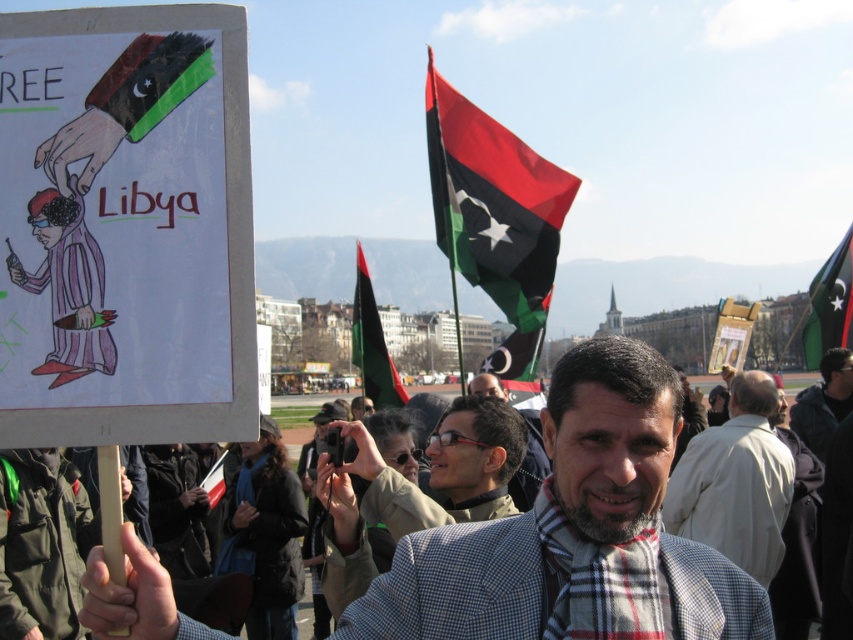
You are a photographer standing 10 meters away from the dark gray jacket at center. You want to take a photo of the matte paper poster at center. Can you reach the poster without moving past the jacket?

The distance between the dark gray jacket at center and the matte paper poster at center is 31.72 meters. Since you are already 10 meters away from the jacket, you would need to move an additional 31.72 meters beyond it to reach the poster. Therefore, you cannot reach the poster without moving past the jacket.

You are a photographer at the protest. You want to take a photo of the matte black jacket at center without the red fabric flag at upper center blocking it. What should you do?

Move the camera so that the matte black jacket at center is positioned in front of the red fabric flag at upper center. Since the matte black jacket at center is currently behind the red fabric flag at upper center, moving the camera angle or repositioning yourself could allow you to frame the jacket without the flag obstructing it.